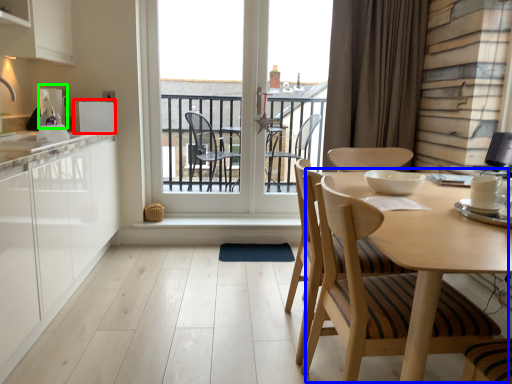
Question: Which object is the farthest from appliance (highlighted by a red box)? Choose among these: round table (highlighted by a blue box) or appliance (highlighted by a green box).

Choices:
 (A) round table
 (B) appliance

Answer: (A)